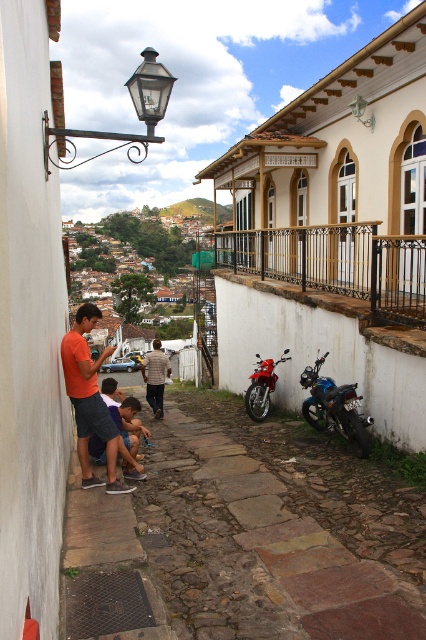
Question: Is the position of blue metallic motorbike at lower center more distant than that of dark blue shorts at lower left?

Choices:
 (A) yes
 (B) no

Answer: (A)

Question: Which object is closer to the camera taking this photo?

Choices:
 (A) dark blue shorts at lower left
 (B) blue metallic motorbike at lower center

Answer: (A)

Question: Is blue metallic motorbike at lower center wider than light brown shirt at center?

Choices:
 (A) yes
 (B) no

Answer: (B)

Question: Does blue metallic motorbike at lower center appear on the left side of shiny red motorcycle at center?

Choices:
 (A) no
 (B) yes

Answer: (A)

Question: Which point is closer to the camera?

Choices:
 (A) (126, 403)
 (B) (80, 388)
 (C) (317, 396)
 (D) (157, 369)

Answer: (B)

Question: Which point is farther from the camera taking this photo?

Choices:
 (A) (143, 371)
 (B) (118, 412)
 (C) (308, 406)
 (D) (265, 397)

Answer: (A)